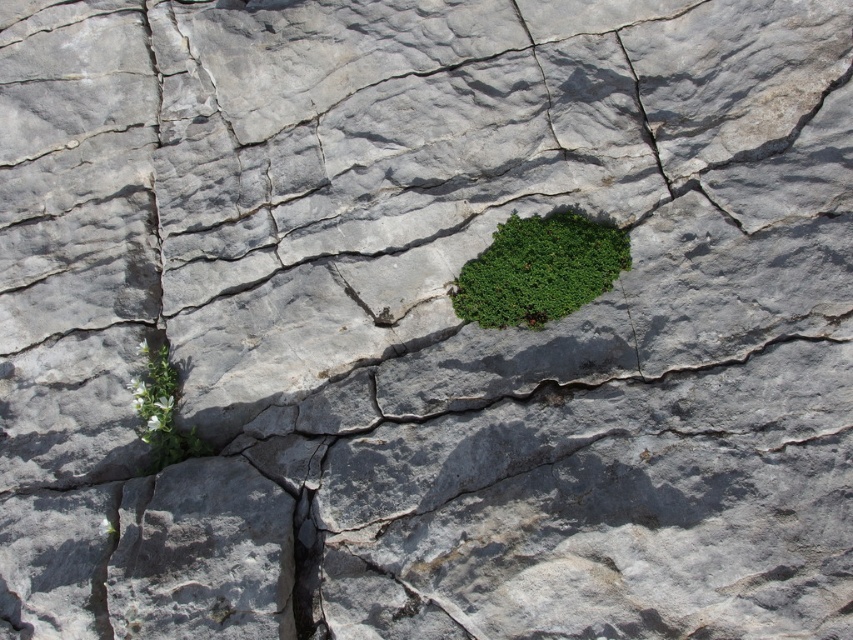
You are standing on the rugged rocky terrain and want to move from point A to point B. Point A is at coordinates point (485, 321) and point B is at coordinates point (294, 621). Which point is closer to you when you start at point A?

Point A at coordinates point (485, 321) is the starting point, so it is closer to you than point B at coordinates point (294, 621).

You are a hiker trying to navigate between the two green leafy plants in the rocky terrain. Which direction should you move from the green leafy plant at center to reach the green leafy plant at lower left?

You should move downward from the green leafy plant at center to reach the green leafy plant at lower left because the green leafy plant at center is located above the green leafy plant at lower left.